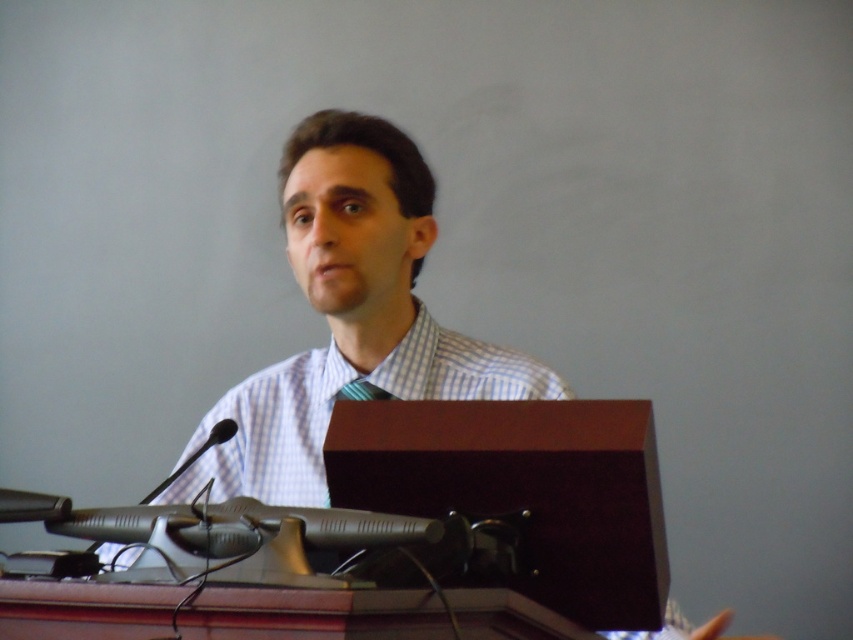
You are a photographer positioned in front of the scene. You need to capture a photo where both the white checkered shirt at center and the metallic silver microphone at left are clearly visible. Based on their positions, which object will appear closer to the camera in the photo?

The white checkered shirt at center will appear closer to the camera in the photo because it is further to the viewer than the metallic silver microphone at left.

You are a sound technician adjusting the microphone stand for a speaker wearing a white checkered shirt at center. The metallic silver microphone at left is currently positioned 10.31 inches away from the speaker. According to safety guidelines, the microphone should be placed no closer than 12 inches from the speaker to avoid feedback. Is the current distance compliant with the guideline?

The distance between the white checkered shirt at center and the metallic silver microphone at left is 10.31 inches, which is closer than the required 12 inches. Therefore, the current positioning does not comply with the safety guidelines and should be adjusted to maintain a minimum distance of 12 inches.

You are a photographer at the event and need to capture a closeup of the speaker. The camera you are using has a focus point at coordinate point [349,316]. What part of the speaker will this focus point capture?

The focus point at coordinate point [349,316] corresponds to the white checkered shirt at center, so the camera will capture the speaker wearing the white checkered shirt at center.